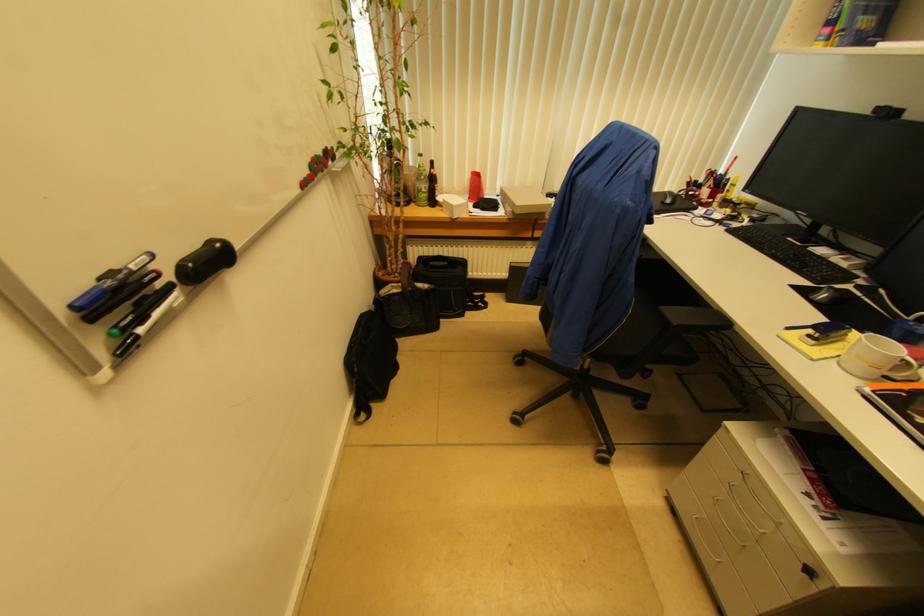
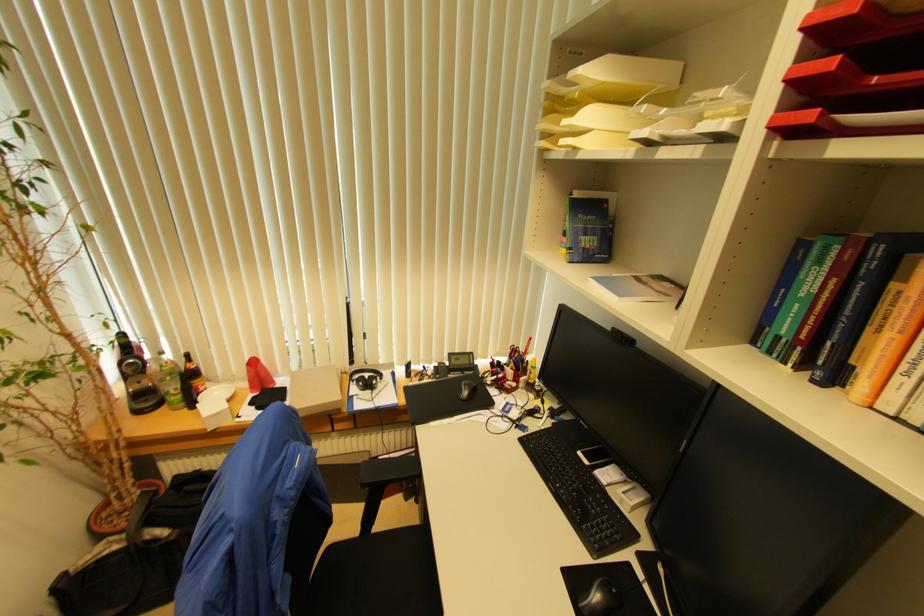
In the second image, find the point that corresponds to pixel 424 192 in the first image.

(174, 394)